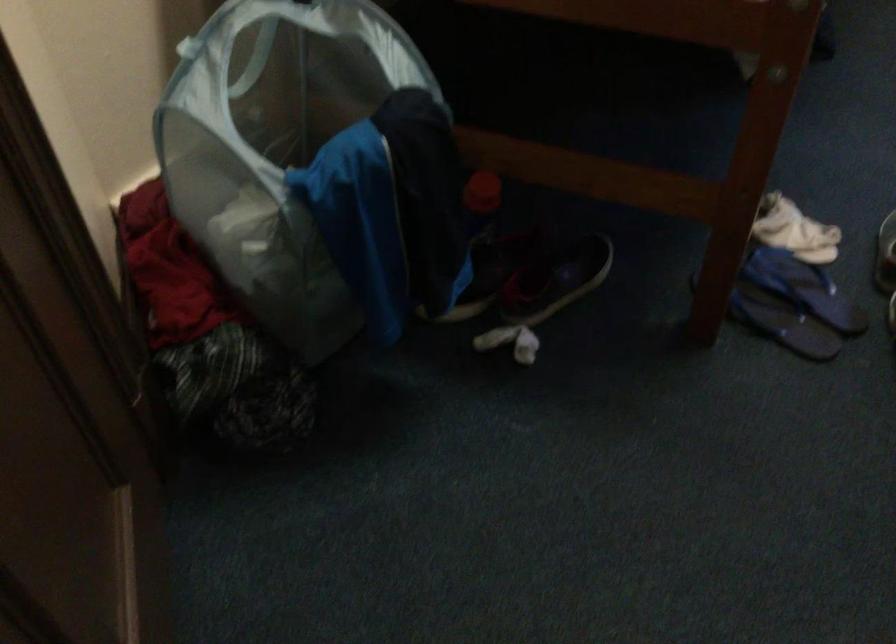
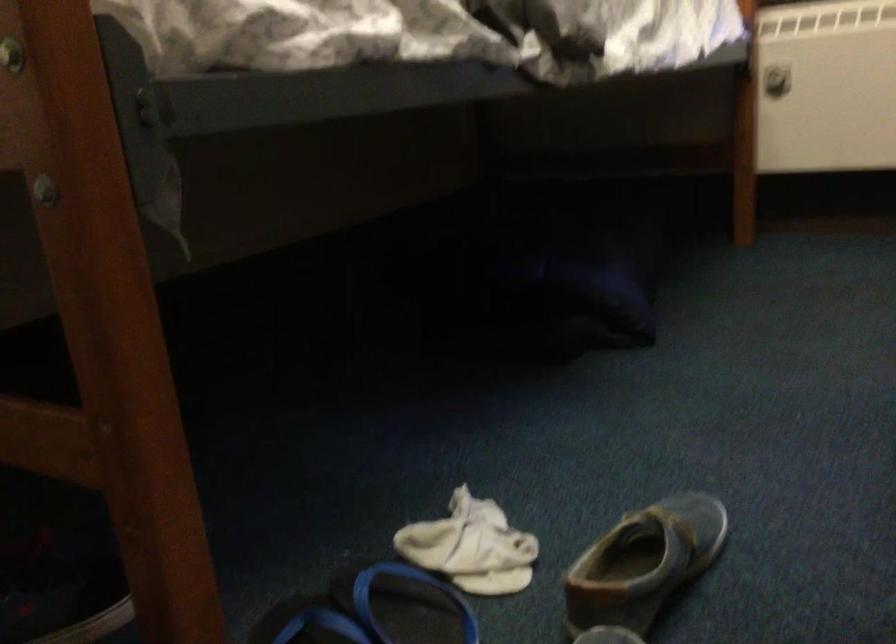
Question: How did the camera likely rotate?

Choices:
 (A) Left
 (B) Right
 (C) Up
 (D) Down

Answer: (C)